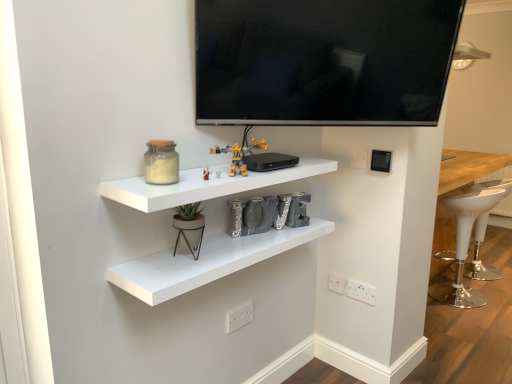
Where is `free space to the back side of metallic yellow toy at center, marked as the 2th toy in a left-to-right arrangement`? free space to the back side of metallic yellow toy at center, marked as the 2th toy in a left-to-right arrangement is located at coordinates (210, 164).